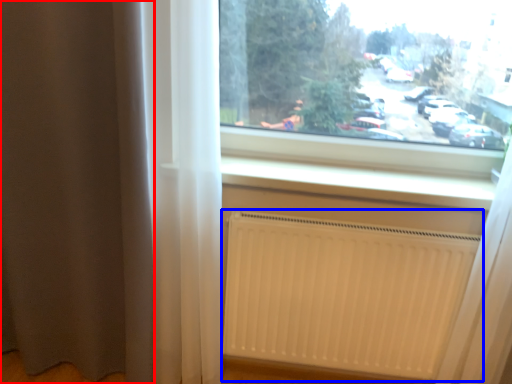
Question: Which point is further to the camera, curtain (highlighted by a red box) or radiator (highlighted by a blue box)?

Choices:
 (A) curtain
 (B) radiator

Answer: (B)